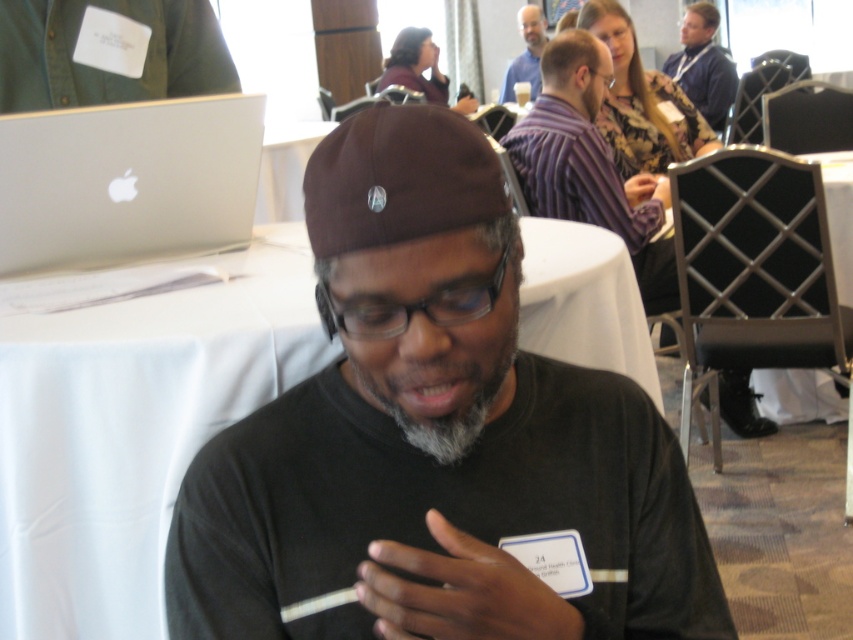
Question: Can you confirm if black matte beanie at center is positioned above gray matte beard at center?

Choices:
 (A) no
 (B) yes

Answer: (A)

Question: Which point appears farthest from the camera in this image?

Choices:
 (A) (723, 61)
 (B) (53, 253)
 (C) (383, 401)

Answer: (A)

Question: Does purple striped shirt at upper center come in front of gray matte beard at center?

Choices:
 (A) yes
 (B) no

Answer: (B)

Question: Can you confirm if gray matte beard at center is positioned to the right of blue shirt at upper center?

Choices:
 (A) no
 (B) yes

Answer: (A)

Question: Which of the following is the farthest from the observer?

Choices:
 (A) black matte beanie at center
 (B) purple striped shirt at upper center
 (C) blue shirt at upper center

Answer: (C)

Question: Which point appears farthest from the camera in this image?

Choices:
 (A) (366, 380)
 (B) (715, 10)
 (C) (207, 29)
 (D) (514, 72)

Answer: (D)